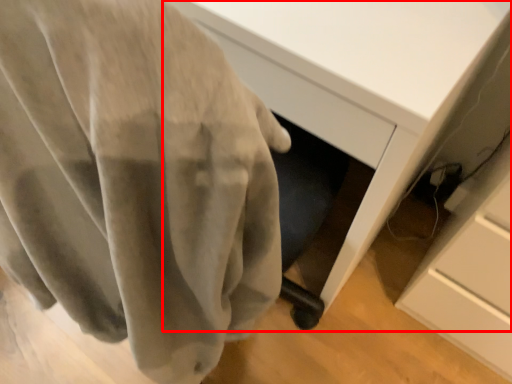
Question: From the image's perspective, where is desk (annotated by the red box) located in relation to curtain in the image?

Choices:
 (A) above
 (B) below

Answer: (A)